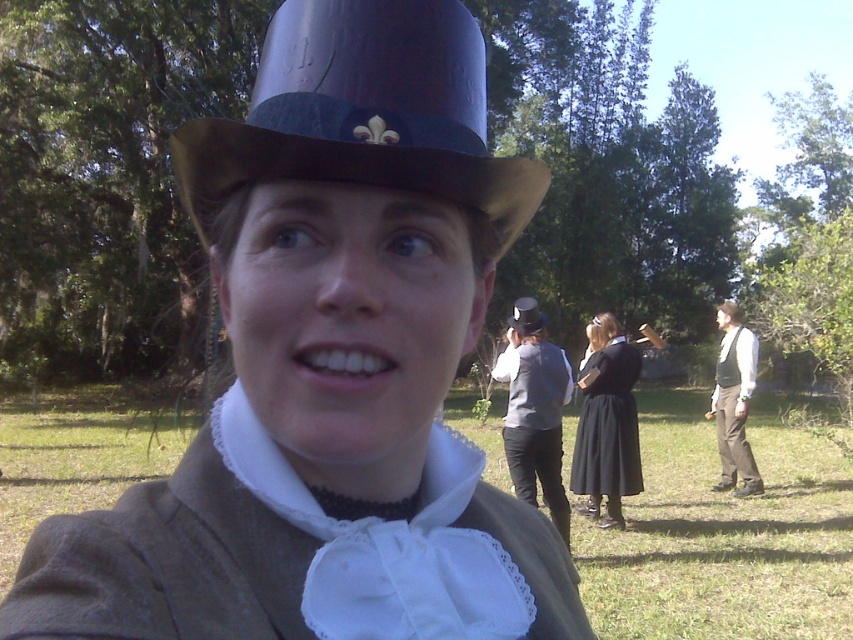
Question: In this image, where is brown leather vest at right located relative to matte black top hat at center?

Choices:
 (A) right
 (B) left

Answer: (A)

Question: Can you confirm if shiny purple dress hat at upper center is smaller than matte black top hat at center?

Choices:
 (A) yes
 (B) no

Answer: (A)

Question: Estimate the real-world distances between objects in this image. Which object is closer to the matte black top hat at upper center?

Choices:
 (A) black satin dress at center
 (B) brown leather vest at right
 (C) matte gray vest at center

Answer: (C)

Question: Considering the real-world distances, which object is farthest from the matte black top hat at center?

Choices:
 (A) matte black top hat at upper center
 (B) matte gray vest at center
 (C) black satin dress at center
 (D) shiny purple dress hat at upper center

Answer: (D)

Question: Is matte black top hat at upper center above matte black top hat at center?

Choices:
 (A) yes
 (B) no

Answer: (B)

Question: Which of the following is the farthest from the observer?

Choices:
 (A) shiny purple dress hat at upper center
 (B) matte black top hat at upper center
 (C) matte black top hat at center

Answer: (C)